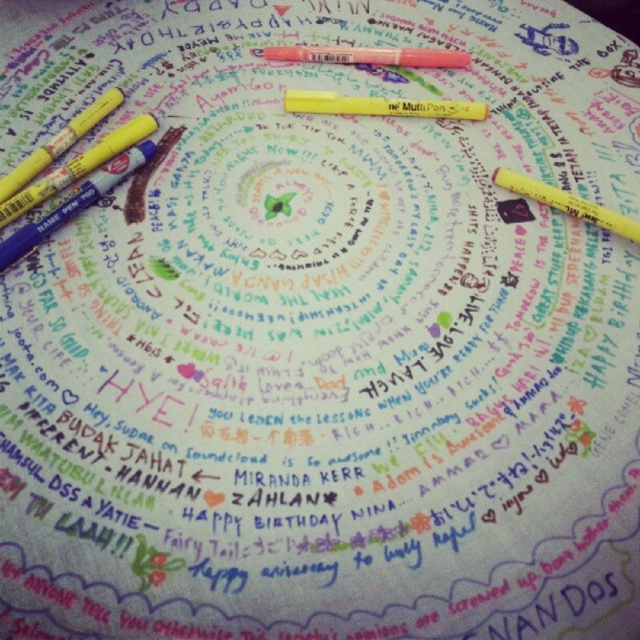
Is yellow matte pen at center bigger than yellow matte marker at upper right?

Actually, yellow matte pen at center might be smaller than yellow matte marker at upper right.

Measure the distance between yellow matte pen at center and yellow matte marker at upper right.

They are 8.55 inches apart.

Where is `yellow matte pen at center`? yellow matte pen at center is located at coordinates (380, 106).

Looking at this image, is yellow matte marker at upper right closer to camera compared to yellow matte marker at upper left?

No, yellow matte marker at upper right is further to the viewer.

Is yellow matte marker at upper right wider than yellow matte marker at upper left?

Indeed, yellow matte marker at upper right has a greater width compared to yellow matte marker at upper left.

Where is `yellow matte marker at upper right`? yellow matte marker at upper right is located at coordinates (566, 204).

Between point (461, 54) and point (113, 90), which one is positioned in front?

Positioned in front is point (113, 90).

Can you confirm if matte pink crayon at center is positioned to the right of yellow matte marker at upper left?

Indeed, matte pink crayon at center is positioned on the right side of yellow matte marker at upper left.

Is point (333, 48) closer to viewer compared to point (77, 113)?

No, (333, 48) is further to viewer.

The image size is (640, 640). In order to click on matte pink crayon at center in this screenshot , I will do `click(369, 54)`.